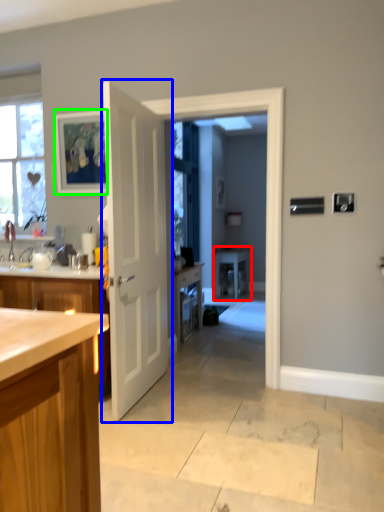
Question: Based on their relative distances, which object is farther from table (highlighted by a red box)? Choose from door (highlighted by a blue box) and picture frame (highlighted by a green box).

Choices:
 (A) door
 (B) picture frame

Answer: (A)